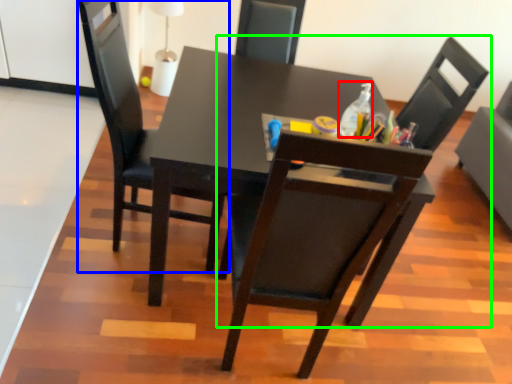
Question: Which object is the farthest from bottle (highlighted by a red box)? Choose among these: chair (highlighted by a blue box) or chair (highlighted by a green box).

Choices:
 (A) chair
 (B) chair

Answer: (A)